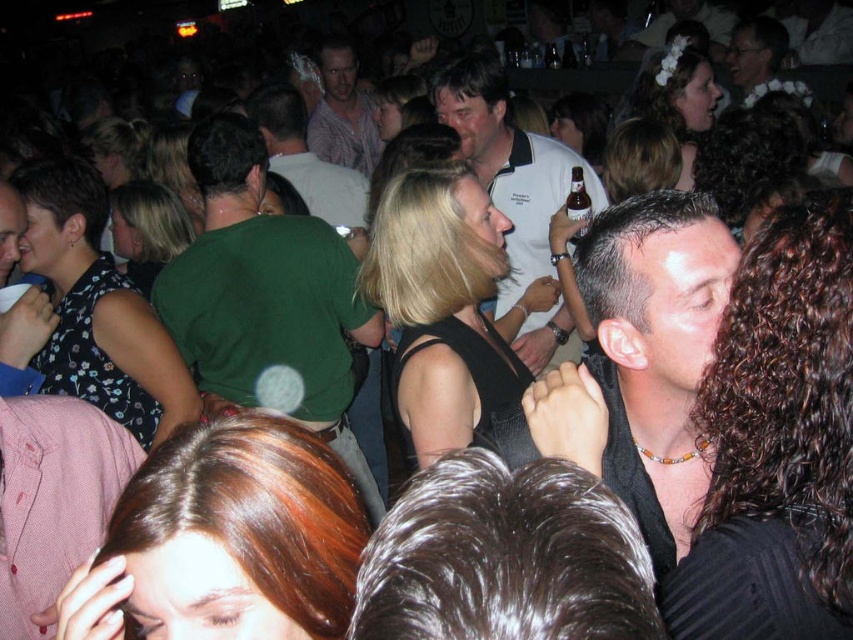
Question: Can you confirm if green cotton shirt at center is thinner than white polo shirt at center?

Choices:
 (A) yes
 (B) no

Answer: (B)

Question: Among these objects, which one is farthest from the camera?

Choices:
 (A) green shirt at center
 (B) white polo shirt at center
 (C) green cotton shirt at center
 (D) black matte shirt at center

Answer: (A)

Question: Among these points, which one is farthest from the camera?

Choices:
 (A) (337, 176)
 (B) (337, 84)
 (C) (523, 144)
 (D) (161, 275)

Answer: (B)

Question: Does white polo shirt at center have a lesser width compared to plaid shirt at center?

Choices:
 (A) yes
 (B) no

Answer: (B)

Question: Can you confirm if black matte shirt at center is positioned to the left of plaid shirt at center?

Choices:
 (A) yes
 (B) no

Answer: (B)

Question: Which point appears closest to the camera in this image?

Choices:
 (A) (317, 269)
 (B) (447, 102)
 (C) (364, 138)
 (D) (300, 176)

Answer: (A)